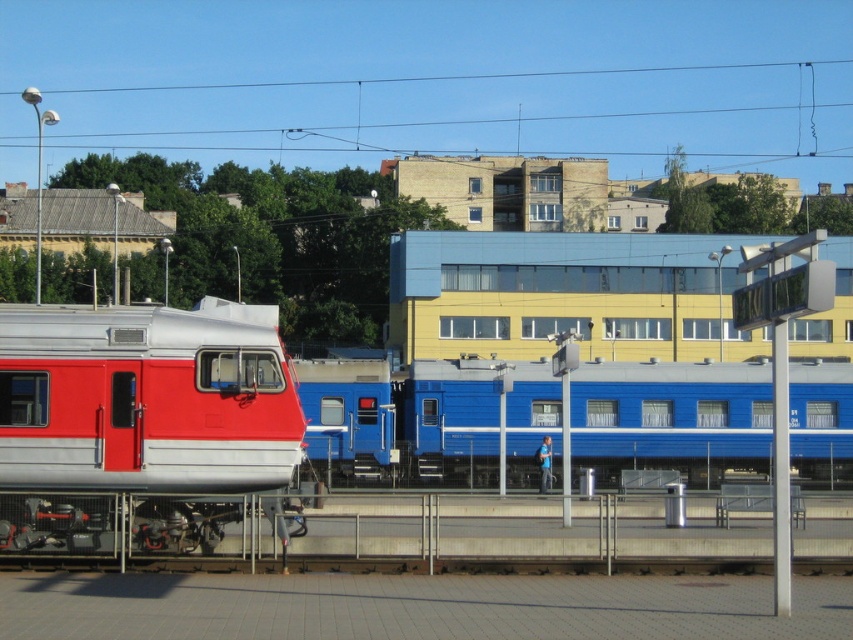
Consider the image. How far apart are blue glossy train car at center and metallic red train at left?

blue glossy train car at center and metallic red train at left are 27.38 meters apart from each other.

Describe the element at coordinates (401, 420) in the screenshot. I see `blue glossy train car at center` at that location.

Where is `blue glossy train car at center`? This screenshot has width=853, height=640. blue glossy train car at center is located at coordinates (401, 420).

Which is in front, point (730, 369) or point (732, 65)?

Point (730, 369)

Does point (492, 416) lie behind point (329, 128)?

No, (492, 416) is in front of (329, 128).

Which is in front, point (608, 458) or point (30, 88)?

Point (608, 458) is more forward.

The width and height of the screenshot is (853, 640). I want to click on blue glossy train car at center, so click(x=401, y=420).

Does point (142, 358) come in front of point (155, 147)?

Yes, it is.

The width and height of the screenshot is (853, 640). Identify the location of metallic red train at left. (146, 397).

Where is `metallic red train at left`? The image size is (853, 640). metallic red train at left is located at coordinates (146, 397).